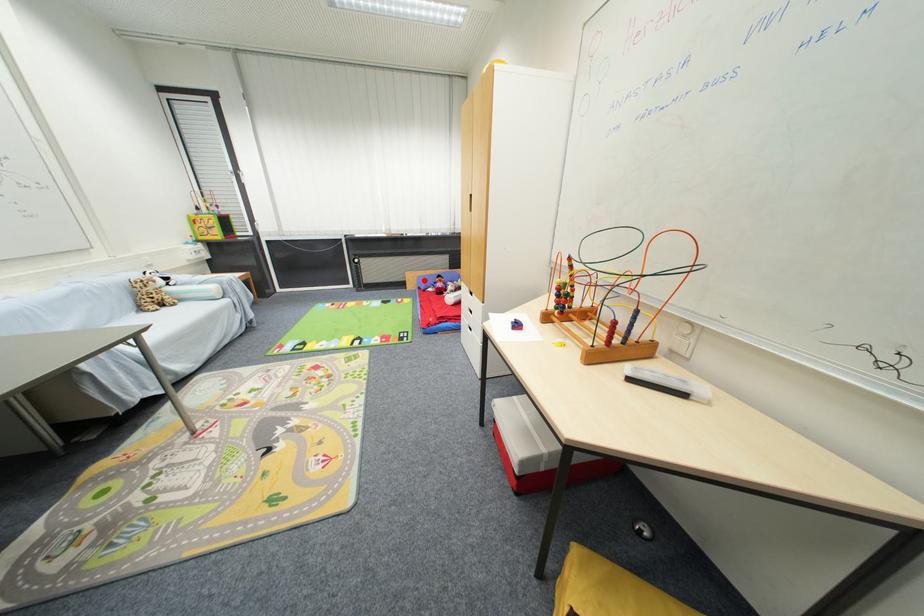
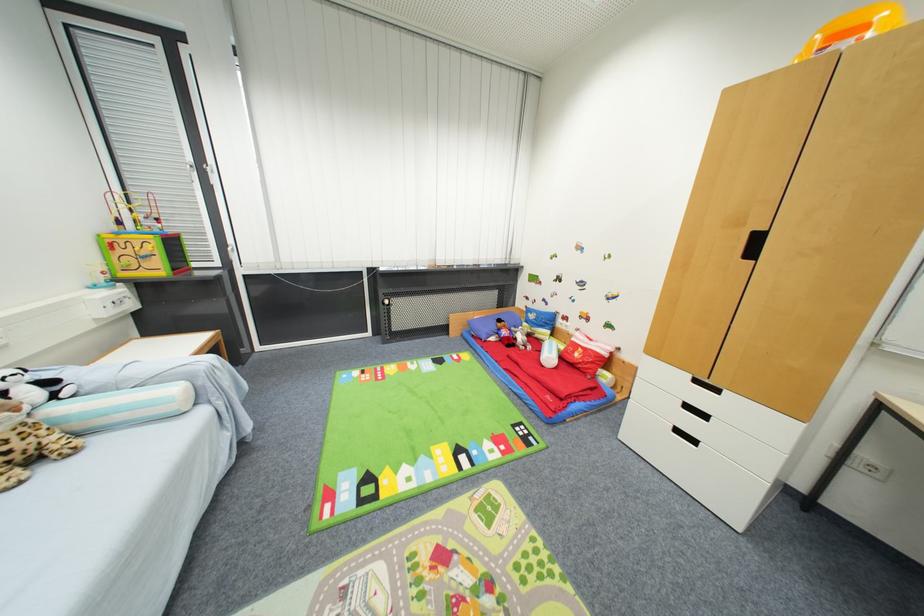
Where in the second image is the point corresponding to the highlighted location from the first image?

(475, 325)